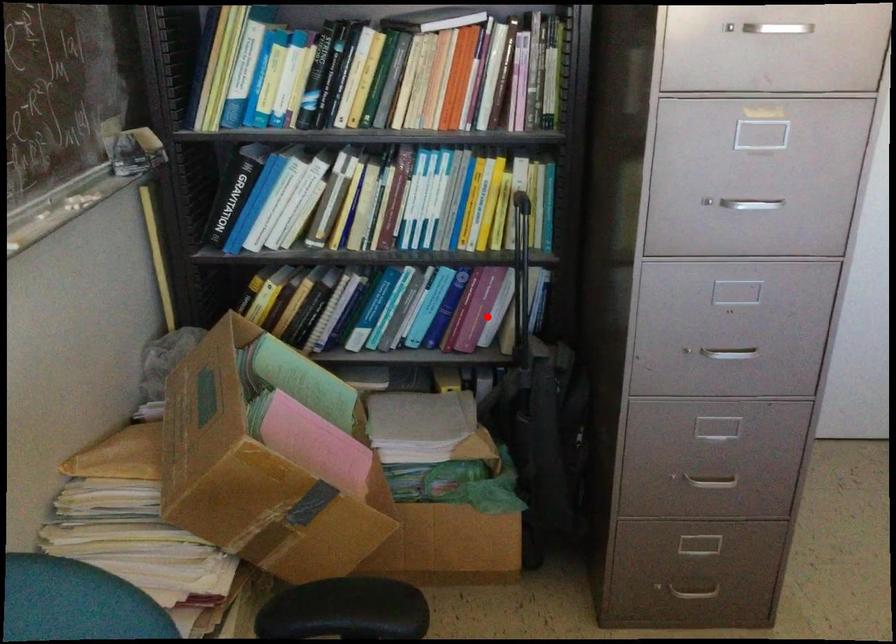
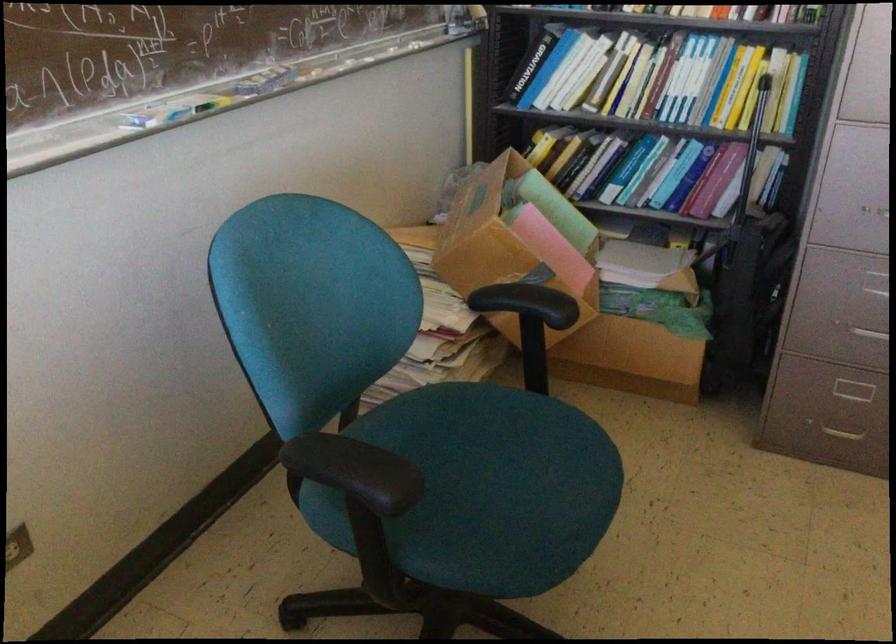
Question: A red point is marked in image1. In image2, is the corresponding 3D point closer to the camera or farther? Reply with the corresponding letter.

Choices:
 (A) The corresponding 3D point is closer.
 (B) The corresponding 3D point is farther.

Answer: (B)